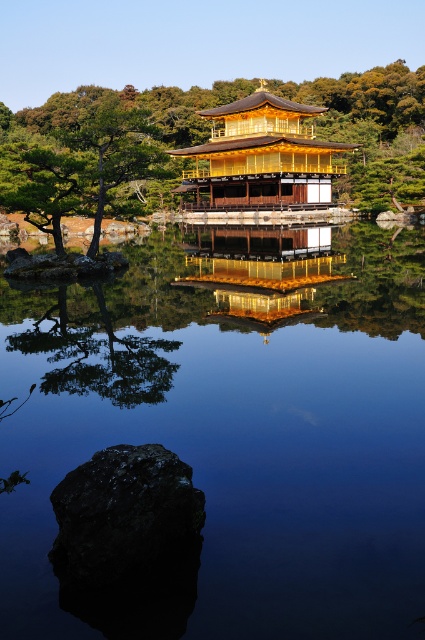
Is transparent glass lake at center to the right of golden polished wood temple at center from the viewer's perspective?

No, transparent glass lake at center is not to the right of golden polished wood temple at center.

Which is behind, point (5, 570) or point (289, 150)?

The point (289, 150) is behind.

Find the location of a particular element. The width and height of the screenshot is (425, 640). transparent glass lake at center is located at coordinates (234, 435).

Locate an element on the screen. transparent glass lake at center is located at coordinates (234, 435).

Is transparent glass lake at center in front of smooth brown tree trunk at upper center?

That is True.

Does transparent glass lake at center have a lesser width compared to smooth brown tree trunk at upper center?

Indeed, transparent glass lake at center has a lesser width compared to smooth brown tree trunk at upper center.

Does point (14, 547) come farther from viewer compared to point (96, 228)?

No, (14, 547) is in front of (96, 228).

Locate an element on the screen. The image size is (425, 640). transparent glass lake at center is located at coordinates (234, 435).

The image size is (425, 640). What do you see at coordinates (234, 435) in the screenshot?
I see `transparent glass lake at center` at bounding box center [234, 435].

Does transparent glass lake at center come behind green leafy tree at center?

No, it is in front of green leafy tree at center.

Is point (172, 316) more distant than point (268, 177)?

No, it is not.

The width and height of the screenshot is (425, 640). Identify the location of transparent glass lake at center. (234, 435).